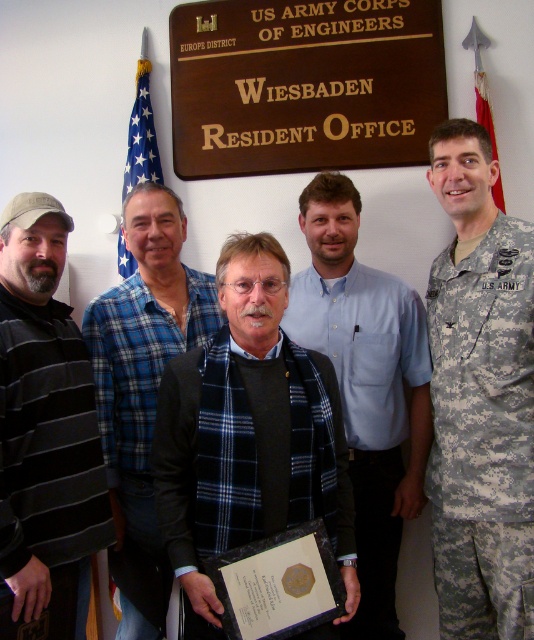
Is camouflage uniform at center to the left of black matte uniform at center from the viewer's perspective?

No, camouflage uniform at center is not to the left of black matte uniform at center.

Is point (489, 605) positioned before point (282, 362)?

That is False.

The image size is (534, 640). I want to click on camouflage uniform at center, so pyautogui.click(x=481, y=397).

Which is in front, point (333, 522) or point (396, 308)?

Point (333, 522) is more forward.

Measure the distance between black matte uniform at center and camera.

black matte uniform at center and camera are 4.91 feet apart from each other.

This screenshot has height=640, width=534. Describe the element at coordinates (247, 449) in the screenshot. I see `black matte uniform at center` at that location.

The width and height of the screenshot is (534, 640). I want to click on black matte uniform at center, so click(247, 449).

Identify the location of black matte uniform at center. (247, 449).

The image size is (534, 640). In order to click on black matte uniform at center in this screenshot , I will do `click(247, 449)`.